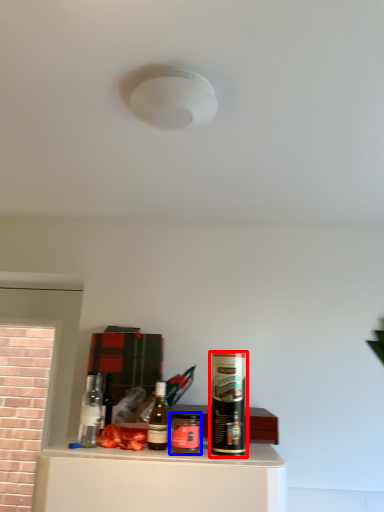
Question: Which point is further to the camera, beverage (highlighted by a red box) or beverage (highlighted by a blue box)?

Choices:
 (A) beverage
 (B) beverage

Answer: (B)